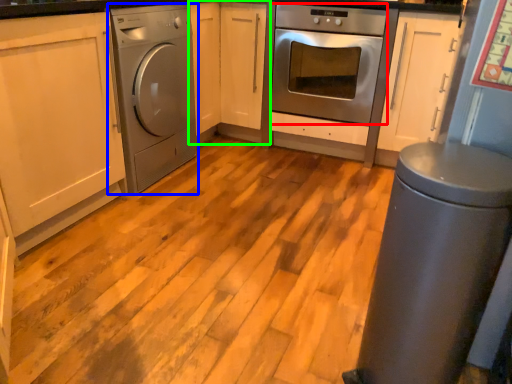
Question: Estimate the real-world distances between objects in this image. Which object is closer to oven (highlighted by a red box), home appliance (highlighted by a blue box) or cabinetry (highlighted by a green box)?

Choices:
 (A) home appliance
 (B) cabinetry

Answer: (B)